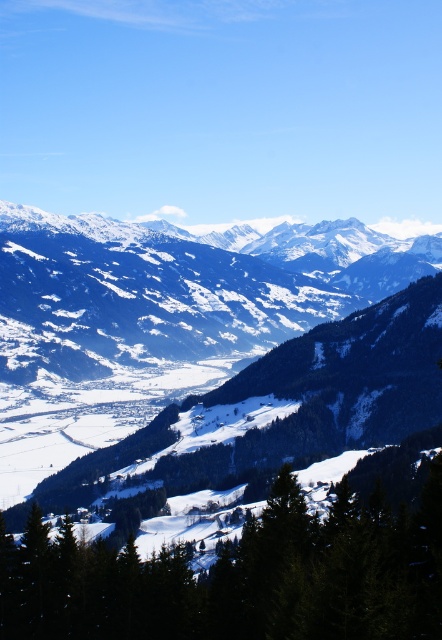
Question: Can you confirm if snowy rocky mountain range at center is positioned above green textured tree at center?

Choices:
 (A) yes
 (B) no

Answer: (A)

Question: Is snowy rocky mountain range at center smaller than green textured tree at center?

Choices:
 (A) yes
 (B) no

Answer: (B)

Question: Among these objects, which one is farthest from the camera?

Choices:
 (A) green textured tree at center
 (B) snowy rocky mountain range at center

Answer: (B)

Question: Which of the following is the closest to the observer?

Choices:
 (A) (340, 634)
 (B) (10, 365)

Answer: (A)

Question: Is snowy rocky mountain range at center wider than green textured tree at center?

Choices:
 (A) yes
 (B) no

Answer: (A)